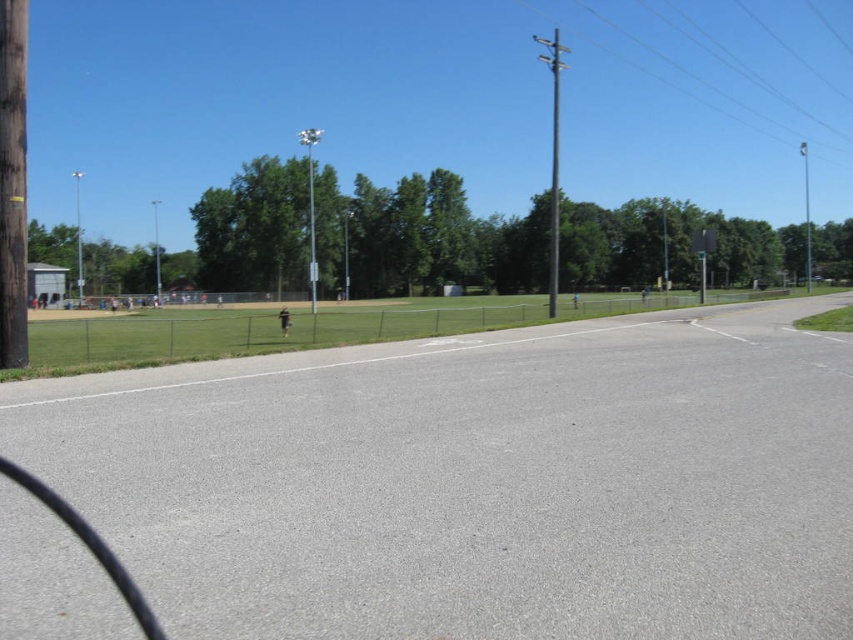
Question: Is silver metallic pole at center thinner than smooth gray pole at center?

Choices:
 (A) no
 (B) yes

Answer: (A)

Question: Which object is positioned closest to the brown wooden telegraph pole at left?

Choices:
 (A) silver metallic pole at center
 (B) metallic gray pole at upper right
 (C) brown wooden telegraph pole at center
 (D) gray metallic pole at left

Answer: (D)

Question: Which object is the farthest from the metallic gray pole at upper right?

Choices:
 (A) smooth gray pole at center
 (B) metallic gray pole at center
 (C) brown wooden telegraph pole at center
 (D) brown wooden telegraph pole at left

Answer: (D)

Question: Among these points, which one is nearest to the camera?

Choices:
 (A) (154, 202)
 (B) (805, 250)
 (C) (76, 232)

Answer: (C)

Question: Is metallic gray pole at center positioned before silver metallic pole at center?

Choices:
 (A) no
 (B) yes

Answer: (B)

Question: Does metallic gray pole at upper right appear under gray metallic pole at left?

Choices:
 (A) no
 (B) yes

Answer: (A)